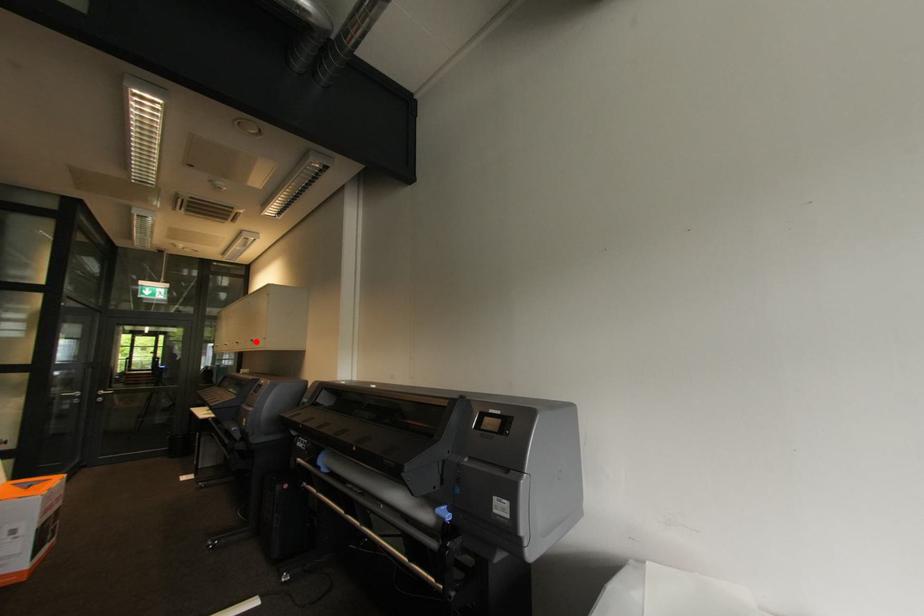
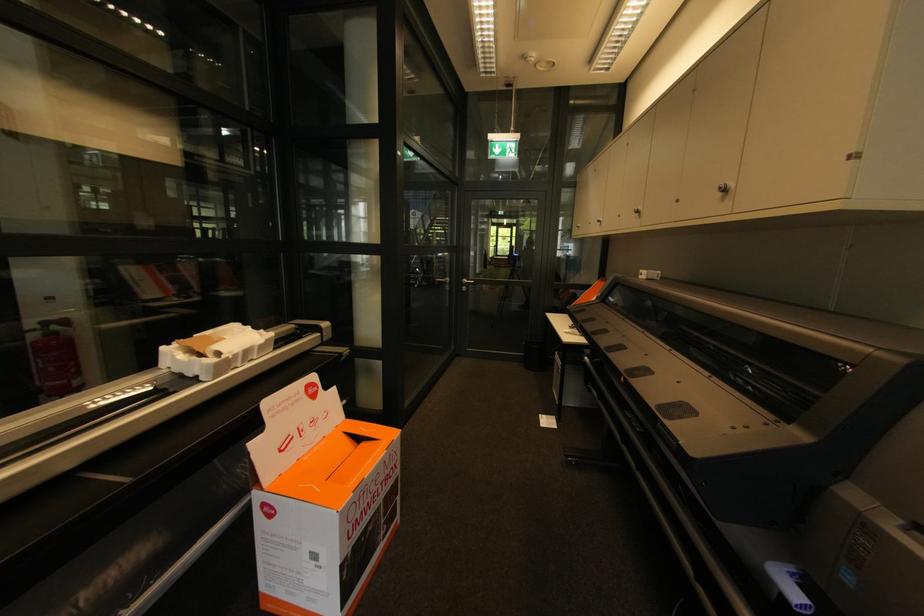
In the second image, find the point that corresponds to the highlighted location in the first image.

(727, 191)